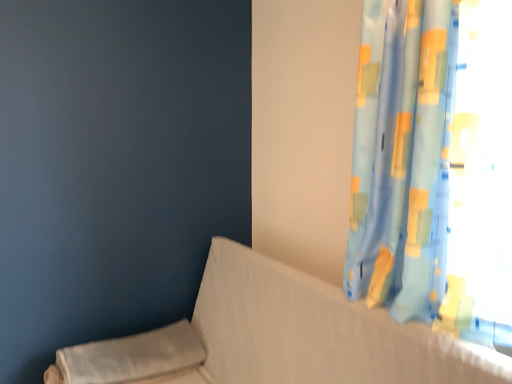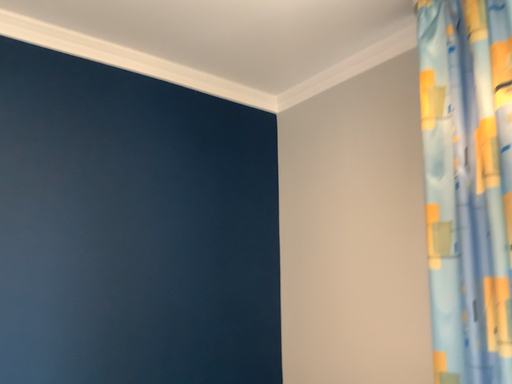
Question: Which way did the camera rotate in the video?

Choices:
 (A) rotated downward
 (B) rotated upward

Answer: (B)